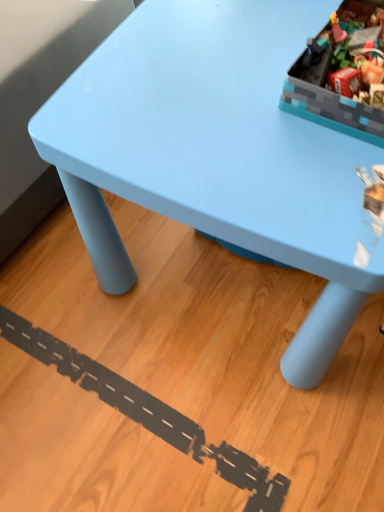
Question: From a real-world perspective, is light blue plastic table at upper center positioned above or below matte plastic storage box at upper right?

Choices:
 (A) below
 (B) above

Answer: (A)

Question: Do you think light blue plastic table at upper center is within matte plastic storage box at upper right, or outside of it?

Choices:
 (A) outside
 (B) inside

Answer: (A)

Question: In the image, is light blue plastic table at upper center positioned in front of or behind matte plastic storage box at upper right?

Choices:
 (A) front
 (B) behind

Answer: (A)

Question: Considering the positions of matte plastic storage box at upper right and light blue plastic table at upper center in the image, is matte plastic storage box at upper right wider or thinner than light blue plastic table at upper center?

Choices:
 (A) thin
 (B) wide

Answer: (A)

Question: From the image's perspective, relative to light blue plastic table at upper center, is matte plastic storage box at upper right above or below?

Choices:
 (A) above
 (B) below

Answer: (A)

Question: Considering their positions, is matte plastic storage box at upper right located in front of or behind light blue plastic table at upper center?

Choices:
 (A) front
 (B) behind

Answer: (B)

Question: Is matte plastic storage box at upper right to the left or to the right of light blue plastic table at upper center in the image?

Choices:
 (A) right
 (B) left

Answer: (A)